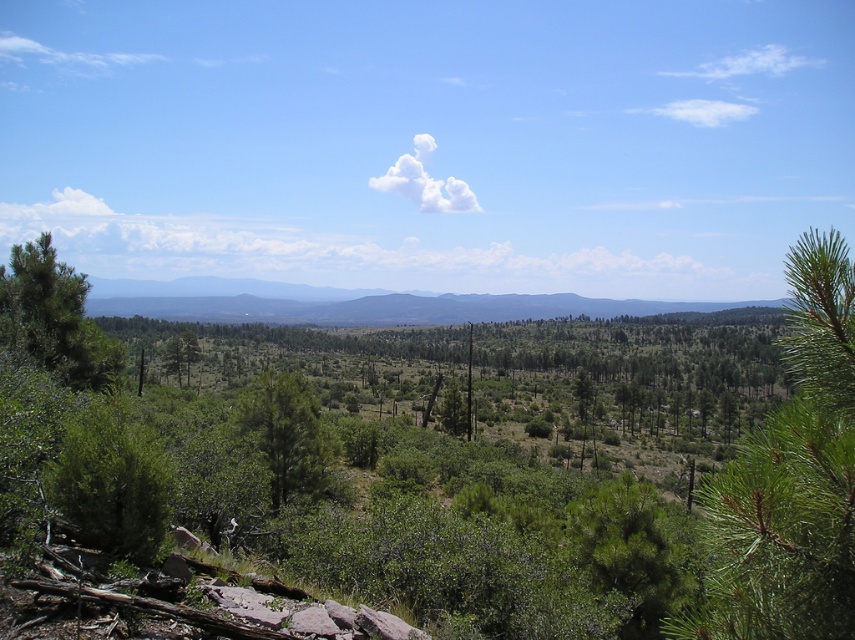
Can you confirm if green matte tree at left is thinner than green matte tree at center?

In fact, green matte tree at left might be wider than green matte tree at center.

Between green matte tree at left and green matte tree at center, which one has more height?

green matte tree at left

Who is more distant from viewer, (54, 330) or (299, 396)?

The point (299, 396) is behind.

I want to click on green matte tree at left, so click(54, 317).

Between point (851, 371) and point (19, 307), which one is positioned behind?

Positioned behind is point (19, 307).

Is point (797, 358) closer to viewer compared to point (93, 339)?

Yes, point (797, 358) is closer to viewer.

Locate an element on the screen. This screenshot has height=640, width=855. green needle-like at upper right is located at coordinates (791, 477).

Describe the element at coordinates (791, 477) in the screenshot. I see `green needle-like at upper right` at that location.

Who is positioned more to the left, green needle-like at upper right or green matte tree at center?

green matte tree at center is more to the left.

Between point (724, 518) and point (278, 481), which one is positioned in front?

Point (724, 518)

Identify the location of green needle-like at upper right. The image size is (855, 640). (791, 477).